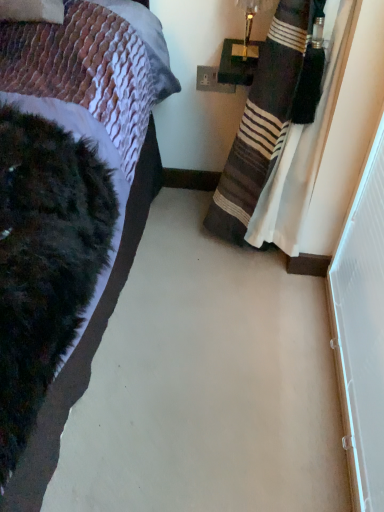
This screenshot has width=384, height=512. I want to click on vacant space in front of striped fabric curtain at right, so click(237, 353).